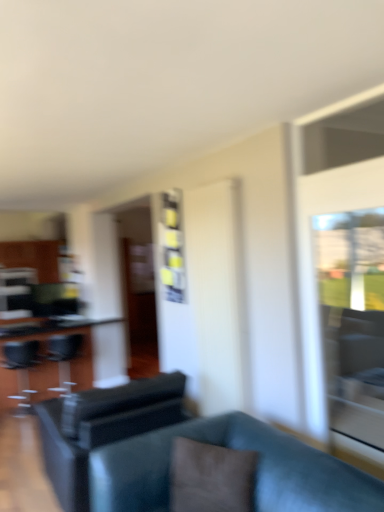
Question: Considering the relative sizes of black leather swivel chair at left, marked as the 1th swivel chair in a left-to-right arrangement, and transparent glass door at right in the image provided, is black leather swivel chair at left, marked as the 1th swivel chair in a left-to-right arrangement, bigger than transparent glass door at right?

Choices:
 (A) no
 (B) yes

Answer: (B)

Question: Is black leather swivel chair at left, marked as the second swivel chair in a front-to-back arrangement, surrounding transparent glass door at right?

Choices:
 (A) yes
 (B) no

Answer: (B)

Question: From a real-world perspective, is black leather swivel chair at left, the 2th swivel chair in the back-to-front sequence, beneath transparent glass door at right?

Choices:
 (A) no
 (B) yes

Answer: (B)

Question: Is black leather swivel chair at left, marked as the 1th swivel chair in a left-to-right arrangement, positioned beyond the bounds of transparent glass door at right?

Choices:
 (A) no
 (B) yes

Answer: (B)

Question: Is black leather swivel chair at left, marked as the 1th swivel chair in a left-to-right arrangement, touching transparent glass door at right?

Choices:
 (A) no
 (B) yes

Answer: (A)

Question: Considering the relative positions of black leather swivel chair at left, the 2th swivel chair in the back-to-front sequence, and transparent glass door at right in the image provided, is black leather swivel chair at left, the 2th swivel chair in the back-to-front sequence, to the left of transparent glass door at right from the viewer's perspective?

Choices:
 (A) yes
 (B) no

Answer: (A)

Question: Can you confirm if transparent glass door at right is wider than matte black swivel chair at left, marked as the 1th swivel chair in a back-to-front arrangement?

Choices:
 (A) no
 (B) yes

Answer: (A)

Question: Is transparent glass door at right shorter than matte black swivel chair at left, the second swivel chair from the right?

Choices:
 (A) no
 (B) yes

Answer: (A)

Question: Considering the relative positions of transparent glass door at right and matte black swivel chair at left, the second swivel chair from the right, in the image provided, is transparent glass door at right to the right of matte black swivel chair at left, the second swivel chair from the right, from the viewer's perspective?

Choices:
 (A) no
 (B) yes

Answer: (B)

Question: Is transparent glass door at right not near matte black swivel chair at left, the third swivel chair positioned from the front?

Choices:
 (A) yes
 (B) no

Answer: (A)

Question: Is transparent glass door at right taller than matte black swivel chair at left, marked as the 1th swivel chair in a back-to-front arrangement?

Choices:
 (A) yes
 (B) no

Answer: (A)

Question: Does transparent glass door at right have a lesser width compared to matte black swivel chair at left, marked as the 1th swivel chair in a back-to-front arrangement?

Choices:
 (A) no
 (B) yes

Answer: (B)

Question: Considering the relative sizes of brown fabric pillow at center and black leather swivel chair at left, marked as the second swivel chair in a front-to-back arrangement, in the image provided, is brown fabric pillow at center shorter than black leather swivel chair at left, marked as the second swivel chair in a front-to-back arrangement,?

Choices:
 (A) no
 (B) yes

Answer: (B)